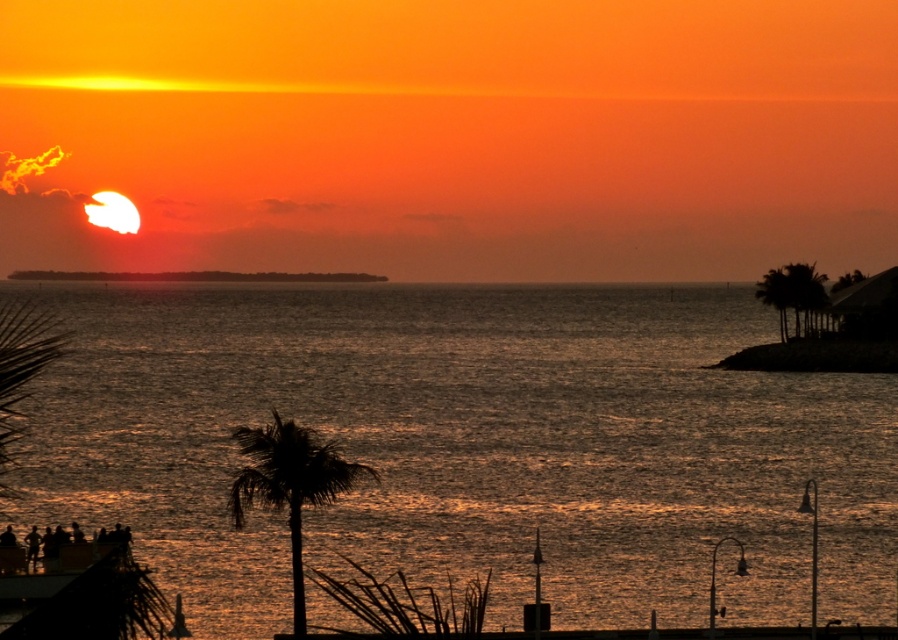
Does silhouette leafy palm at lower center have a lesser height compared to green leafy palm tree at right?

Correct, silhouette leafy palm at lower center is not as tall as green leafy palm tree at right.

Is silhouette leafy palm at lower center thinner than green leafy palm tree at right?

No, silhouette leafy palm at lower center is not thinner than green leafy palm tree at right.

Does point (331, 444) lie behind point (764, 292)?

No, it is not.

Locate an element on the screen. This screenshot has height=640, width=898. silhouette leafy palm at lower center is located at coordinates (289, 483).

Identify the location of shiny metallic water at center. This screenshot has width=898, height=640. (469, 448).

Does shiny metallic water at center appear on the left side of silhouette leafy palm at lower center?

Indeed, shiny metallic water at center is positioned on the left side of silhouette leafy palm at lower center.

Does point (165, 560) come in front of point (315, 454)?

No, (165, 560) is further to viewer.

Where is `shiny metallic water at center`? Image resolution: width=898 pixels, height=640 pixels. shiny metallic water at center is located at coordinates (469, 448).

Between shiny metallic water at center and green leafy palm tree at right, which one has less height?

green leafy palm tree at right

Is shiny metallic water at center smaller than green leafy palm tree at right?

Incorrect, shiny metallic water at center is not smaller in size than green leafy palm tree at right.

Identify the location of shiny metallic water at center. (469, 448).

Locate an element on the screen. Image resolution: width=898 pixels, height=640 pixels. shiny metallic water at center is located at coordinates (469, 448).